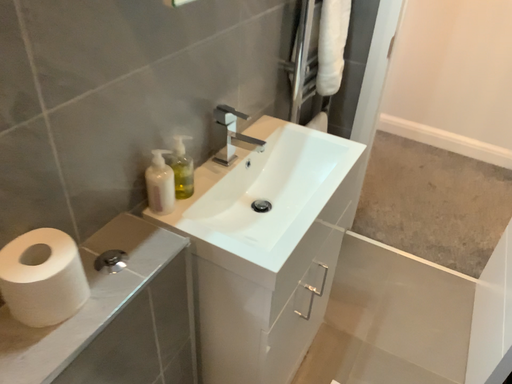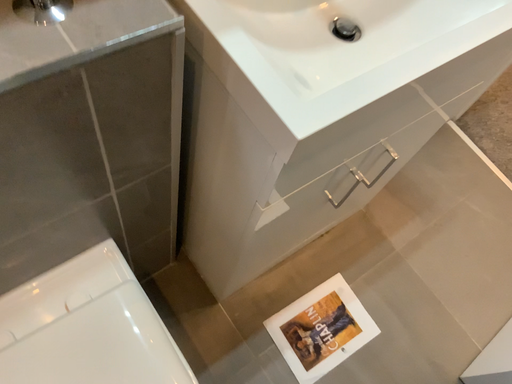
Question: Which way did the camera rotate in the video?

Choices:
 (A) rotated right
 (B) rotated left

Answer: (B)